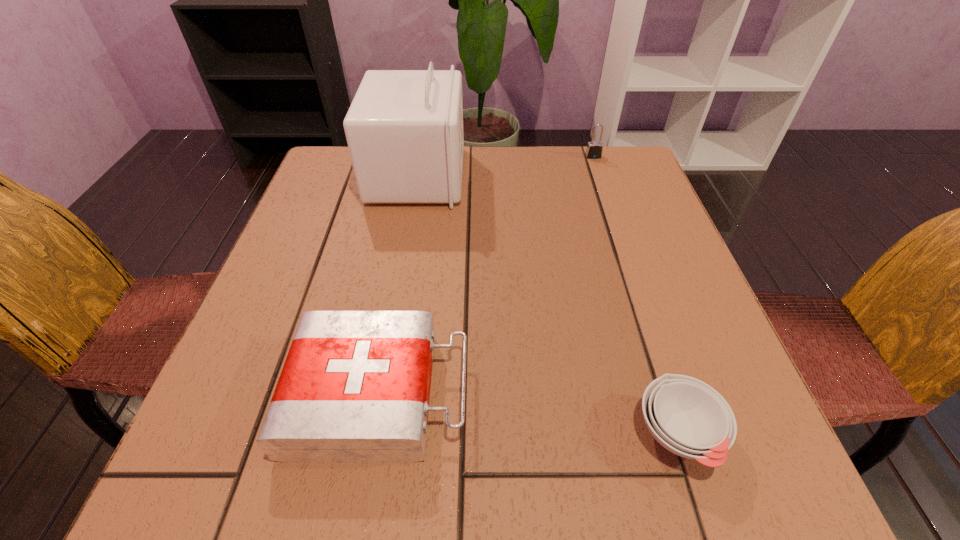
In the image, there is a desktop. Where is `vacant space at the far edge`? This screenshot has width=960, height=540. vacant space at the far edge is located at coordinates (x=465, y=183).

At what (x,y) coordinates should I click in order to perform the action: click on vacant area at the near edge. Please return your answer as a coordinate pair (x, y). Image resolution: width=960 pixels, height=540 pixels. Looking at the image, I should click on (493, 470).

Identify the location of free region at the left edge of the desktop. (349, 236).

This screenshot has width=960, height=540. Identify the location of vacant space at the right edge of the desktop. (654, 238).

At what (x,y) coordinates should I click in order to perform the action: click on vacant space at the far left corner of the desktop. Please return your answer as a coordinate pair (x, y). Image resolution: width=960 pixels, height=540 pixels. Looking at the image, I should click on (324, 181).

The width and height of the screenshot is (960, 540). Identify the location of vacant point at the far right corner. point(640,167).

I want to click on vacant region at the near right corner of the desktop, so click(707, 492).

You are a GUI agent. You are given a task and a screenshot of the screen. Output one action in this format:
    pyautogui.click(x=<x>, y=<y>)
    Task: Click on the vacant area that lies between the third tallest object and the shortest object
    This screenshot has width=960, height=540.
    Given the screenshot: What is the action you would take?
    pyautogui.click(x=528, y=414)

The height and width of the screenshot is (540, 960). Find the location of `free spot between the nearer first-aid kit and the shortest object`. free spot between the nearer first-aid kit and the shortest object is located at coordinates 528,414.

This screenshot has width=960, height=540. Identify the location of vacant area that lies between the shortest object and the padlock. (636, 295).